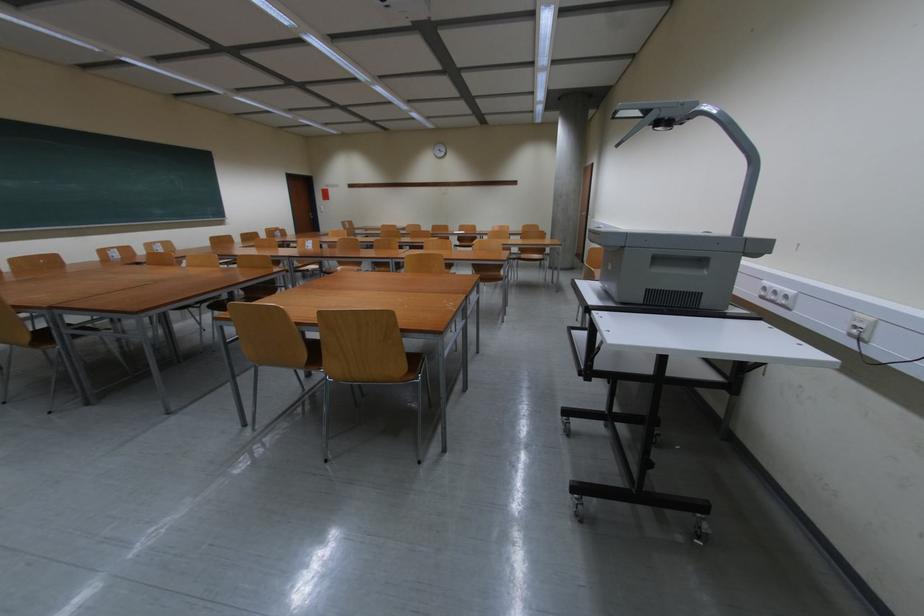
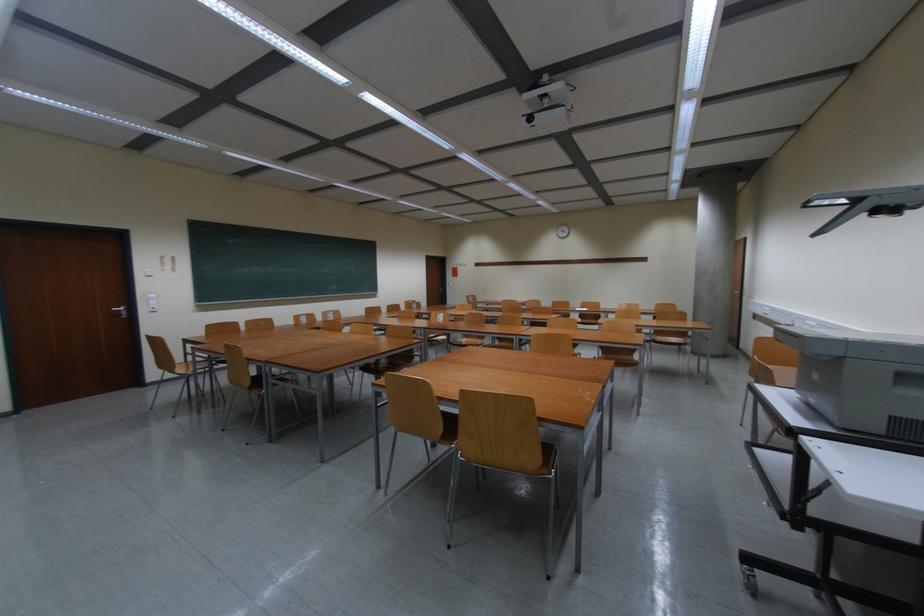
Question: Based on the continuous images, in which direction is the camera rotating? Reply with the corresponding letter.

Choices:
 (A) Left
 (B) Right
 (C) Up
 (D) Down

Answer: (A)